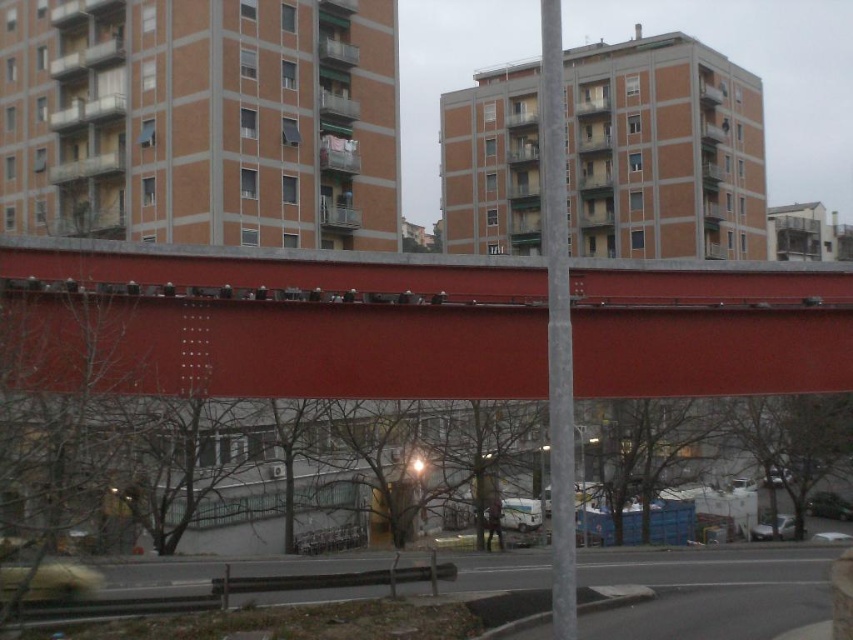
Is smooth red bridge at center thinner than gray concrete pole at center?

Indeed, smooth red bridge at center has a lesser width compared to gray concrete pole at center.

Based on the photo, is smooth red bridge at center above gray concrete pole at center?

No, smooth red bridge at center is not above gray concrete pole at center.

Image resolution: width=853 pixels, height=640 pixels. What are the coordinates of `smooth red bridge at center` in the screenshot? It's located at (297, 317).

Can you confirm if smooth red bridge at center is taller than dark brown leather jacket at center?

Correct, smooth red bridge at center is much taller as dark brown leather jacket at center.

Which is above, smooth red bridge at center or dark brown leather jacket at center?

smooth red bridge at center is above.

Identify the location of smooth red bridge at center. The height and width of the screenshot is (640, 853). (297, 317).

From the picture: Does gray concrete pole at center appear under dark brown leather jacket at center?

No.

Which of these two, gray concrete pole at center or dark brown leather jacket at center, stands shorter?

With less height is dark brown leather jacket at center.

Does point (560, 337) lie in front of point (490, 536)?

Yes, point (560, 337) is in front of point (490, 536).

In order to click on gray concrete pole at center in this screenshot , I will do `click(556, 323)`.